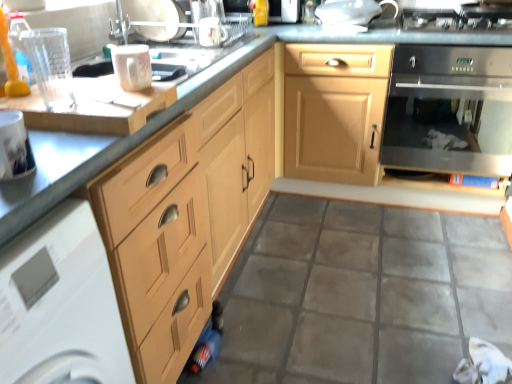
Image resolution: width=512 pixels, height=384 pixels. Find the location of `porcelain glossy mug at upper center, which is counted as the third appliance, starting from the left`. porcelain glossy mug at upper center, which is counted as the third appliance, starting from the left is located at coordinates (132, 66).

The height and width of the screenshot is (384, 512). Describe the element at coordinates (132, 66) in the screenshot. I see `porcelain glossy mug at upper center, the fifth appliance in the back-to-front sequence` at that location.

The height and width of the screenshot is (384, 512). Describe the element at coordinates (351, 14) in the screenshot. I see `white glossy toaster at upper center, marked as the 6th appliance in a left-to-right arrangement` at that location.

At what (x,y) coordinates should I click in order to perform the action: click on white glossy dishwasher at lower left, marked as the first home appliance in a front-to-back arrangement. Please return your answer as a coordinate pair (x, y). Looking at the image, I should click on (60, 304).

What do you see at coordinates (450, 110) in the screenshot?
I see `stainless steel oven at right, placed as the second home appliance when sorted from bottom to top` at bounding box center [450, 110].

Locate an element on the screen. The height and width of the screenshot is (384, 512). white glossy mug at upper center, which is counted as the fourth appliance, starting from the back is located at coordinates (211, 32).

Is matte wood cabinet at center behind stainless steel oven at right, which is the first home appliance in top-to-bottom order?

No.

From the image's perspective, which one is positioned lower, matte wood cabinet at center or stainless steel oven at right, positioned as the 1th home appliance in back-to-front order?

matte wood cabinet at center, from the image's perspective.

Can you confirm if matte wood cabinet at center is shorter than stainless steel oven at right, arranged as the second home appliance when viewed from the front?

Incorrect, the height of matte wood cabinet at center does not fall short of that of stainless steel oven at right, arranged as the second home appliance when viewed from the front.

Looking at this image, is white glossy toaster at upper center, which ranks as the first appliance in right-to-left order, positioned with its back to matte wood cabinet at center?

No, white glossy toaster at upper center, which ranks as the first appliance in right-to-left order, is not facing away from matte wood cabinet at center.

From a real-world perspective, is white glossy toaster at upper center, positioned as the 6th appliance in front-to-back order, positioned above or below matte wood cabinet at center?

white glossy toaster at upper center, positioned as the 6th appliance in front-to-back order, is situated higher than matte wood cabinet at center in the real world.

What's the angular difference between white glossy toaster at upper center, marked as the 6th appliance in a left-to-right arrangement, and matte wood cabinet at center's facing directions?

white glossy toaster at upper center, marked as the 6th appliance in a left-to-right arrangement, and matte wood cabinet at center are facing 2.48 degrees away from each other.

From the image's perspective, is matte wood cabinet at center located above clear glass tumbler at upper left, acting as the sixth appliance starting from the right?

Yes, from the image's perspective, matte wood cabinet at center is over clear glass tumbler at upper left, acting as the sixth appliance starting from the right.

Where is `appliance that is the 3rd object located in front of the matte wood cabinet at center`? appliance that is the 3rd object located in front of the matte wood cabinet at center is located at coordinates (51, 66).

Between matte wood cabinet at center and clear glass tumbler at upper left, acting as the 6th appliance starting from the back, which one has less height?

clear glass tumbler at upper left, acting as the 6th appliance starting from the back.

Considering the relative sizes of matte wood cabinet at center and clear glass tumbler at upper left, acting as the sixth appliance starting from the right, in the image provided, is matte wood cabinet at center smaller than clear glass tumbler at upper left, acting as the sixth appliance starting from the right,?

Actually, matte wood cabinet at center might be larger than clear glass tumbler at upper left, acting as the sixth appliance starting from the right.

Which object is wider, black metallic gas stove at upper right or light wood cabinet at center?

light wood cabinet at center.

From the image's perspective, is black metallic gas stove at upper right located above or below light wood cabinet at center?

Clearly, from the image's perspective, black metallic gas stove at upper right is above light wood cabinet at center.

Is light wood cabinet at center at the back of black metallic gas stove at upper right?

No, black metallic gas stove at upper right is not facing the opposite direction of light wood cabinet at center.

Can we say black metallic gas stove at upper right lies outside light wood cabinet at center?

Yes.

Is white glossy dishwasher at lower left, which is the first home appliance in left-to-right order, situated inside white glossy mug at left or outside?

white glossy dishwasher at lower left, which is the first home appliance in left-to-right order, is not enclosed by white glossy mug at left.

From a real-world perspective, who is located higher, white glossy dishwasher at lower left, the second home appliance when ordered from top to bottom, or white glossy mug at left?

white glossy mug at left.

Which is more distant, (9, 343) or (18, 164)?

The point (18, 164) is behind.

Based on the photo, how far apart are white glossy dishwasher at lower left, which is the first home appliance in left-to-right order, and white glossy mug at left?

white glossy dishwasher at lower left, which is the first home appliance in left-to-right order, and white glossy mug at left are 21.78 centimeters apart.

Would you say white glossy mug at upper center, the 5th appliance in the left-to-right sequence, is a long distance from porcelain glossy mug at upper center, which is counted as the third appliance, starting from the left?

That's not correct — white glossy mug at upper center, the 5th appliance in the left-to-right sequence, is a little close to porcelain glossy mug at upper center, which is counted as the third appliance, starting from the left.

Is white glossy mug at upper center, the 5th appliance in the left-to-right sequence, facing away from porcelain glossy mug at upper center, the fourth appliance in the right-to-left sequence?

No, white glossy mug at upper center, the 5th appliance in the left-to-right sequence,'s orientation is not away from porcelain glossy mug at upper center, the fourth appliance in the right-to-left sequence.

Is white glossy mug at upper center, the third appliance positioned from the front, bigger or smaller than porcelain glossy mug at upper center, which ranks as the 2th appliance in front-to-back order?

Considering their sizes, white glossy mug at upper center, the third appliance positioned from the front, takes up less space than porcelain glossy mug at upper center, which ranks as the 2th appliance in front-to-back order.

Is clear glass tumbler at upper left, marked as the first appliance in a front-to-back arrangement, facing away from stainless steel oven at right, arranged as the second home appliance when viewed from the front?

clear glass tumbler at upper left, marked as the first appliance in a front-to-back arrangement, is not turned away from stainless steel oven at right, arranged as the second home appliance when viewed from the front.

From a real-world perspective, which is physically below, clear glass tumbler at upper left, acting as the sixth appliance starting from the right, or stainless steel oven at right, which is the first home appliance in top-to-bottom order?

From a 3D spatial view, stainless steel oven at right, which is the first home appliance in top-to-bottom order, is below.

The height and width of the screenshot is (384, 512). Find the location of `dresser that appears on the left of stainless steel oven at right, acting as the first home appliance starting from the right`. dresser that appears on the left of stainless steel oven at right, acting as the first home appliance starting from the right is located at coordinates (350, 138).

The image size is (512, 384). Find the location of `dresser on the right of white glossy toaster at upper center, marked as the 6th appliance in a left-to-right arrangement`. dresser on the right of white glossy toaster at upper center, marked as the 6th appliance in a left-to-right arrangement is located at coordinates (350, 138).

Estimate the real-world distances between objects in this image. Which object is closer to clear glass tumbler at upper left, which is the 1th appliance in left-to-right order, light wood cabinet at center or white glossy dishwasher at lower left, the second home appliance when ordered from top to bottom?

white glossy dishwasher at lower left, the second home appliance when ordered from top to bottom.

When comparing their distances from porcelain glossy mug at upper center, which is counted as the third appliance, starting from the left, does stainless steel oven at right, arranged as the second home appliance when viewed from the front, or white glossy plate rack at upper center, acting as the fourth appliance starting from the front, seem closer?

white glossy plate rack at upper center, acting as the fourth appliance starting from the front, is positioned closer to the anchor porcelain glossy mug at upper center, which is counted as the third appliance, starting from the left.

From the picture: Estimate the real-world distances between objects in this image. Which object is closer to matte wood cabinet at center, black metallic gas stove at upper right or white glossy plate rack at upper center, the second appliance viewed from the left?

black metallic gas stove at upper right lies closer to matte wood cabinet at center than the other object.

Based on their spatial positions, is light wood cabinet at center or metallic silver sink at upper center, positioned as the 5th appliance in front-to-back order, further from matte wood cabinet at center?

light wood cabinet at center lies further to matte wood cabinet at center than the other object.

Which object lies further to the anchor point clear glass tumbler at upper left, acting as the sixth appliance starting from the right, black metallic gas stove at upper right or white glossy plate rack at upper center, the 3th appliance when ordered from back to front?

black metallic gas stove at upper right.

Looking at the image, which one is located closer to matte wood cabinet at center, black metallic gas stove at upper right or white glossy toaster at upper center, which ranks as the first appliance in right-to-left order?

white glossy toaster at upper center, which ranks as the first appliance in right-to-left order, is closer to matte wood cabinet at center.

Which object lies nearer to the anchor point clear glass tumbler at upper left, marked as the first appliance in a front-to-back arrangement, stainless steel oven at right, arranged as the second home appliance when viewed from the front, or white glossy mug at left?

white glossy mug at left is positioned closer to the anchor clear glass tumbler at upper left, marked as the first appliance in a front-to-back arrangement.

Based on their spatial positions, is white glossy mug at upper center, the third appliance positioned from the front, or light wood cabinet at center further from porcelain glossy mug at upper center, which ranks as the 2th appliance in front-to-back order?

white glossy mug at upper center, the third appliance positioned from the front, lies further to porcelain glossy mug at upper center, which ranks as the 2th appliance in front-to-back order, than the other object.

Find the location of a particular element. kitchen appliance located between white glossy dishwasher at lower left, which is the second home appliance from right to left, and metallic silver sink at upper center, the second appliance positioned from the back, in the depth direction is located at coordinates click(x=14, y=146).

In order to click on dresser positioned between white glossy mug at left and metallic silver sink at upper center, acting as the 3th appliance starting from the right, from near to far in this screenshot , I will do `click(350, 138)`.

Locate an element on the screen. This screenshot has height=384, width=512. dresser between clear glass tumbler at upper left, which is the 1th appliance in left-to-right order, and black metallic gas stove at upper right, in the horizontal direction is located at coordinates (350, 138).

I want to click on dresser between light wood cabinet at center and black metallic gas stove at upper right in the horizontal direction, so click(x=350, y=138).